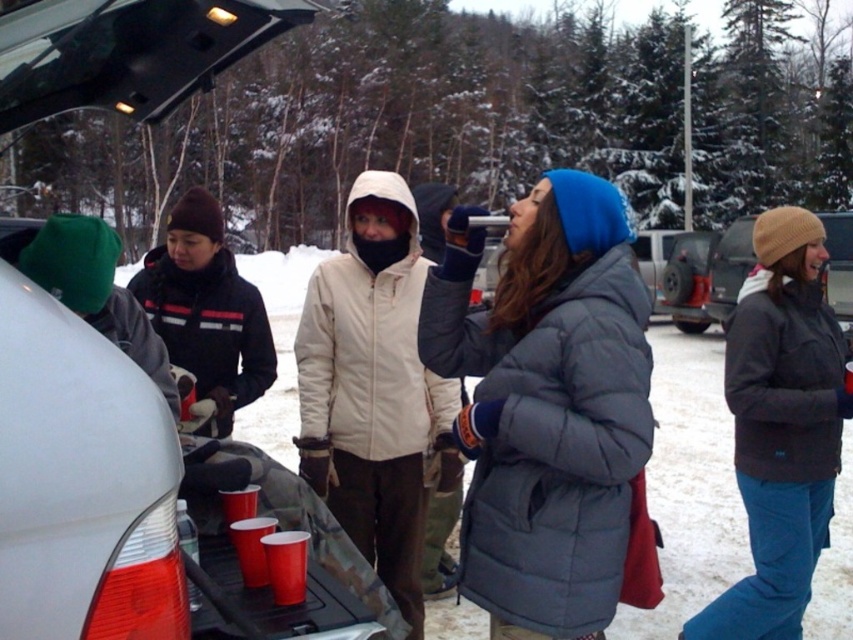
Question: Is black fleece jacket at left above shiny plastic cup at lower center?

Choices:
 (A) no
 (B) yes

Answer: (B)

Question: Does shiny plastic cup at lower center have a lesser width compared to matte plastic cup at lower center?

Choices:
 (A) yes
 (B) no

Answer: (A)

Question: Is gray puffy coat at center bigger than dark gray fleece jacket at center?

Choices:
 (A) no
 (B) yes

Answer: (A)

Question: Which point is farther from the camera taking this photo?

Choices:
 (A) (254, 538)
 (B) (204, 291)
 (C) (350, 426)

Answer: (B)

Question: Estimate the real-world distances between objects in this image. Which object is closer to the black fleece jacket at left?

Choices:
 (A) matte black suv at right
 (B) gray puffy coat at center

Answer: (B)

Question: Which point appears closest to the camera in this image?

Choices:
 (A) (268, 536)
 (B) (440, 342)
 (C) (265, 580)
 (D) (775, 566)

Answer: (A)